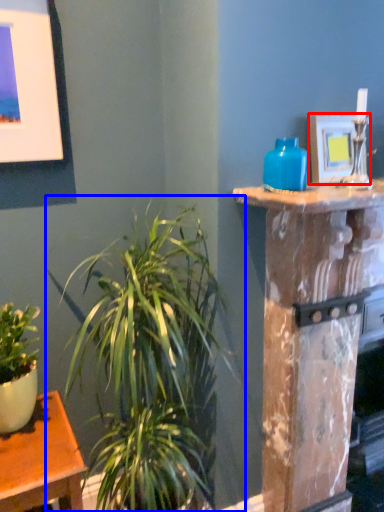
Question: Which point is further to the camera, picture frame (highlighted by a red box) or houseplant (highlighted by a blue box)?

Choices:
 (A) picture frame
 (B) houseplant

Answer: (A)